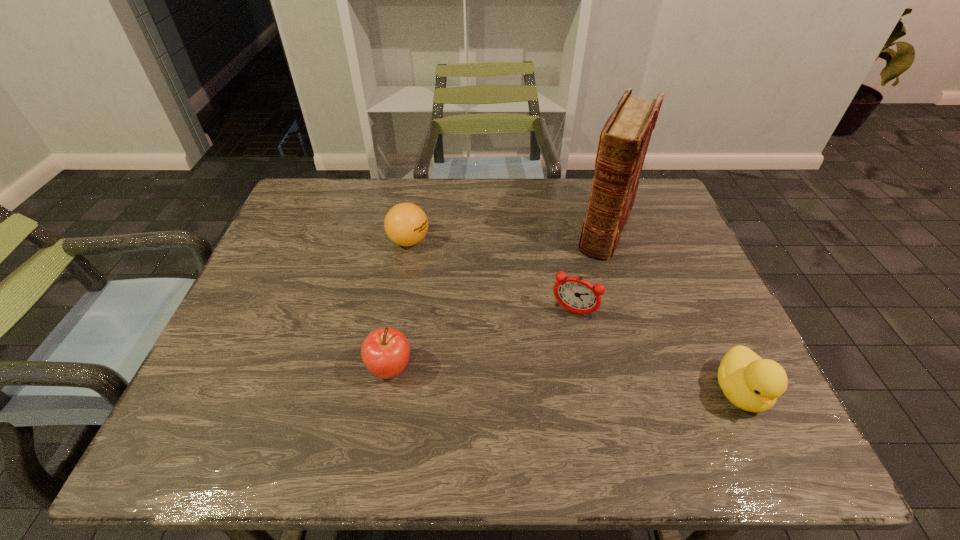
Where is `blank space located on the spine side of the hardback book`? This screenshot has width=960, height=540. blank space located on the spine side of the hardback book is located at coordinates (558, 356).

Identify the location of free space located 0.330m on the spine side of the hardback book. This screenshot has width=960, height=540. (562, 346).

What are the coordinates of `free space located 0.210m on the front-facing side of the third nearest object` in the screenshot? It's located at (534, 393).

This screenshot has width=960, height=540. What are the coordinates of `vacant space situated on the front-facing side of the third nearest object` in the screenshot? It's located at (550, 356).

Where is `free space located 0.100m on the front-facing side of the third nearest object`? This screenshot has width=960, height=540. free space located 0.100m on the front-facing side of the third nearest object is located at coordinates click(551, 353).

Locate an element on the screen. This screenshot has height=540, width=960. object at the far edge is located at coordinates (624, 139).

The image size is (960, 540). Find the location of `apple present at the near edge`. apple present at the near edge is located at coordinates (385, 352).

The image size is (960, 540). What are the coordinates of `duck that is positioned at the near edge` in the screenshot? It's located at (751, 383).

At what (x,y) coordinates should I click in order to perform the action: click on duck that is positioned at the right edge. Please return your answer as a coordinate pair (x, y). Looking at the image, I should click on pyautogui.click(x=751, y=383).

I want to click on hardback book that is positioned at the right edge, so click(624, 139).